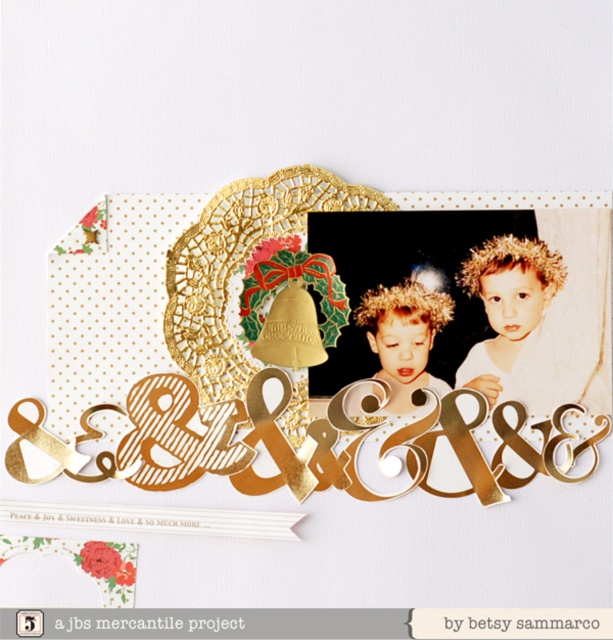
Based on the photo, does matte gold photo frame at center have a greater width compared to blonde hair child at center?

Yes.

Which is more to the right, matte gold photo frame at center or blonde hair child at center?

From the viewer's perspective, blonde hair child at center appears more on the right side.

Is point (338, 262) positioned after point (503, 260)?

Yes, point (338, 262) is farther from viewer.

Locate an element on the screen. The image size is (613, 640). matte gold photo frame at center is located at coordinates (479, 298).

Who is positioned more to the left, matte gold photo frame at center or gold glitter hairband at center?

Positioned to the left is gold glitter hairband at center.

Locate an element on the screen. matte gold photo frame at center is located at coordinates (479, 298).

This screenshot has height=640, width=613. I want to click on matte gold photo frame at center, so tap(479, 298).

Can you confirm if blonde hair child at center is taller than gold glitter hairband at center?

Indeed, blonde hair child at center has a greater height compared to gold glitter hairband at center.

Which is more to the right, blonde hair child at center or gold glitter hairband at center?

Positioned to the right is blonde hair child at center.

Identify the location of blonde hair child at center. The image size is (613, 640). (506, 305).